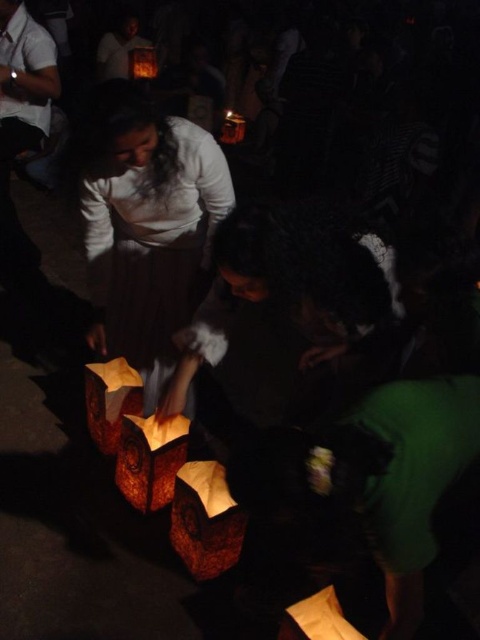
Question: From the image, what is the correct spatial relationship of matte paper lantern at upper center in relation to brown paper lantern at upper center?

Choices:
 (A) above
 (B) below

Answer: (A)

Question: Is rustic paper lantern at center positioned behind brown paper lantern at center?

Choices:
 (A) yes
 (B) no

Answer: (B)

Question: Which point is closer to the camera?

Choices:
 (A) (238, 122)
 (B) (144, 61)
 (C) (108, 173)

Answer: (C)

Question: Among these objects, which one is farthest from the camera?

Choices:
 (A) matte brown paper lantern at center
 (B) brown paper lantern at center

Answer: (B)

Question: Which point is closer to the camera?

Choices:
 (A) (192, 508)
 (B) (147, 74)
 (C) (314, 621)

Answer: (C)

Question: Does brown paper lantern at center come in front of matte paper lantern at upper center?

Choices:
 (A) no
 (B) yes

Answer: (B)